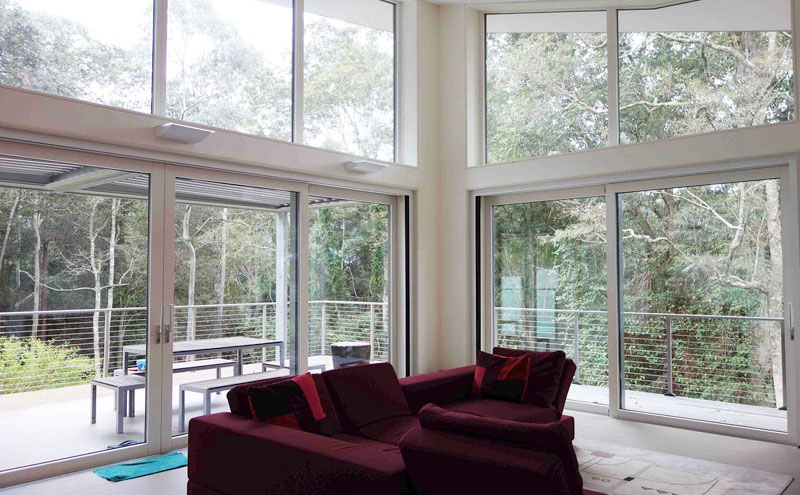
Find the location of a particular element. floor is located at coordinates (622, 431).